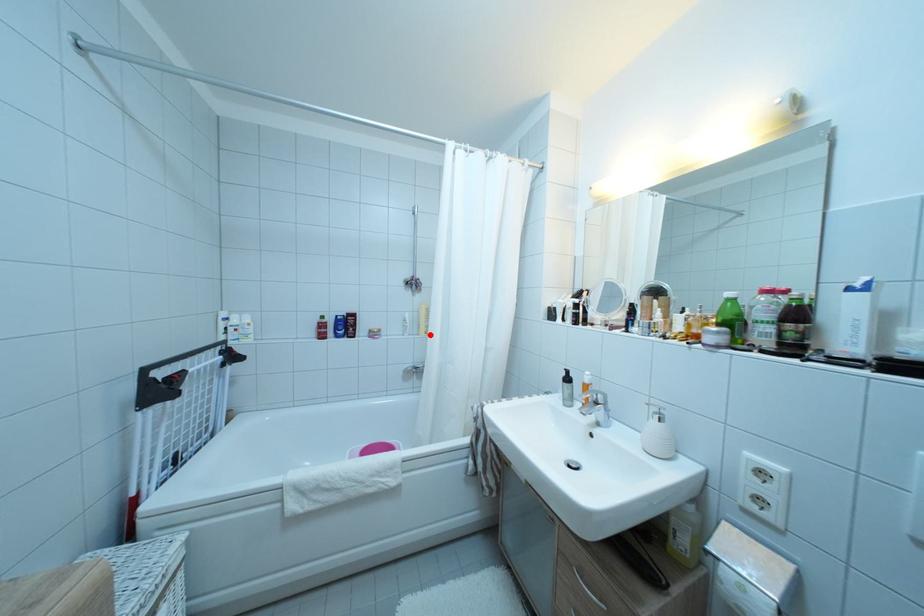
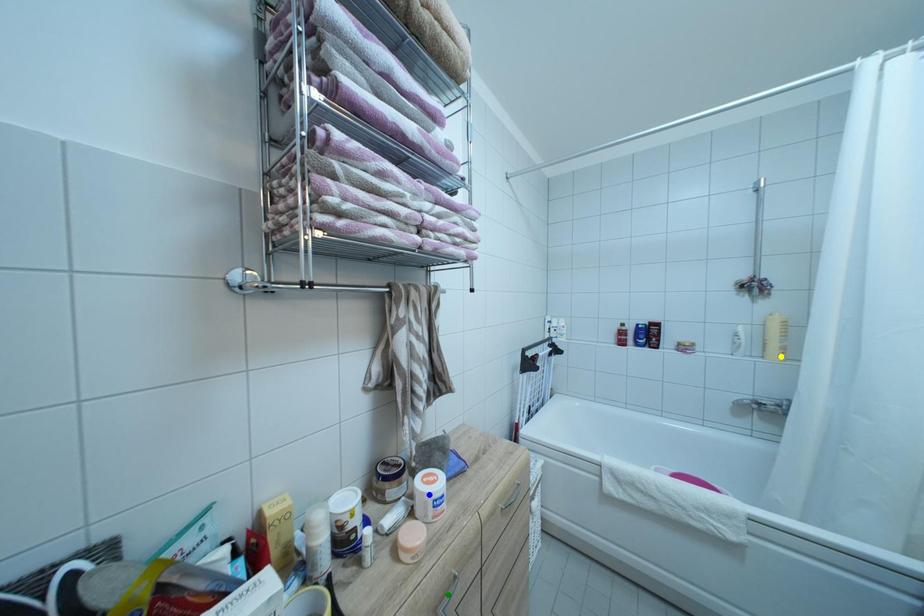
Question: I am providing you with two images of the same scene from different viewpoints. A red point is marked on the first image. You are given multiple points on the second image. Which point in image 2 represents the same 3d spot as the red point in image 1?

Choices:
 (A) blue point
 (B) green point
 (C) yellow point

Answer: (C)